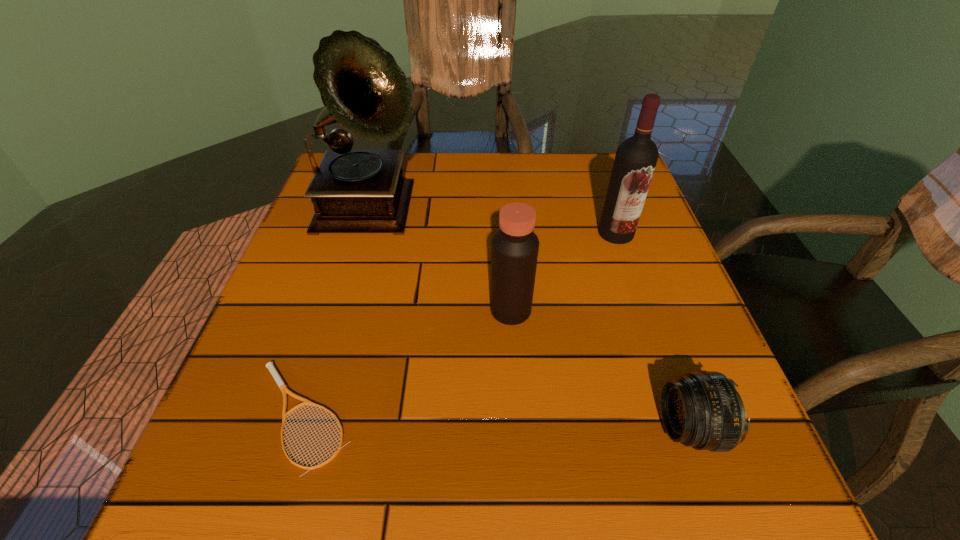
Where is `the tallest object`? Image resolution: width=960 pixels, height=540 pixels. the tallest object is located at coordinates (363, 89).

I want to click on the fourth shortest object, so click(636, 157).

I want to click on the third farthest object, so click(515, 246).

This screenshot has width=960, height=540. In order to click on vinegar in this screenshot , I will do `click(515, 246)`.

You are a GUI agent. You are given a task and a screenshot of the screen. Output one action in this format:
    pyautogui.click(x=<x>, y=<y>)
    Task: Click on the second shortest object
    This screenshot has width=960, height=540.
    Given the screenshot: What is the action you would take?
    pyautogui.click(x=703, y=410)

Identify the location of tennis racket. Image resolution: width=960 pixels, height=540 pixels. (x=270, y=365).

Where is `free location located 0.150m on the horn of the record player`? free location located 0.150m on the horn of the record player is located at coordinates (488, 213).

Find the location of a particular element. vacant region located 0.070m on the label of the wine bottle is located at coordinates (627, 267).

Identify the location of free space located 0.200m on the front of the vinegar. This screenshot has height=540, width=960. (518, 429).

Where is `free location located at the front element of the second shortest object`? Image resolution: width=960 pixels, height=540 pixels. free location located at the front element of the second shortest object is located at coordinates (622, 428).